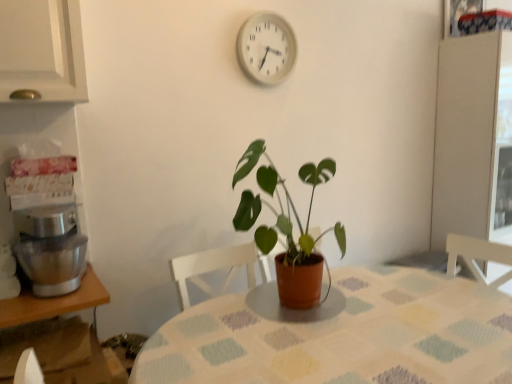
Question: Is white plastic clock at upper center positioned beyond the bounds of green matte plant at center?

Choices:
 (A) yes
 (B) no

Answer: (A)

Question: Is white plastic clock at upper center next to green matte plant at center?

Choices:
 (A) no
 (B) yes

Answer: (A)

Question: Can you confirm if white plastic clock at upper center is smaller than green matte plant at center?

Choices:
 (A) yes
 (B) no

Answer: (A)

Question: From the image's perspective, is white plastic clock at upper center under green matte plant at center?

Choices:
 (A) yes
 (B) no

Answer: (B)

Question: Considering the relative positions of white plastic clock at upper center and green matte plant at center in the image provided, is white plastic clock at upper center to the right of green matte plant at center from the viewer's perspective?

Choices:
 (A) yes
 (B) no

Answer: (B)

Question: Is the depth of white plastic clock at upper center less than that of green matte plant at center?

Choices:
 (A) no
 (B) yes

Answer: (A)

Question: Can you confirm if wooden table at lower left, placed as the 2th table when sorted from right to left, is wider than white plastic clock at upper center?

Choices:
 (A) yes
 (B) no

Answer: (A)

Question: Is the position of wooden table at lower left, placed as the 2th table when sorted from right to left, more distant than that of white plastic clock at upper center?

Choices:
 (A) yes
 (B) no

Answer: (B)

Question: Is wooden table at lower left, placed as the 2th table when sorted from right to left, closer to the viewer compared to white plastic clock at upper center?

Choices:
 (A) no
 (B) yes

Answer: (B)

Question: Does wooden table at lower left, placed as the 2th table when sorted from right to left, have a lesser height compared to white plastic clock at upper center?

Choices:
 (A) yes
 (B) no

Answer: (A)

Question: Is wooden table at lower left, which appears as the 1th table when viewed from the left, outside white plastic clock at upper center?

Choices:
 (A) yes
 (B) no

Answer: (A)

Question: Considering the relative sizes of wooden table at lower left, placed as the 2th table when sorted from right to left, and white plastic clock at upper center in the image provided, is wooden table at lower left, placed as the 2th table when sorted from right to left, bigger than white plastic clock at upper center?

Choices:
 (A) no
 (B) yes

Answer: (B)

Question: From a real-world perspective, is wooden table at lower left, placed as the 2th table when sorted from right to left, physically below textured fabric table at center, which appears as the first table when viewed from the right?

Choices:
 (A) yes
 (B) no

Answer: (B)